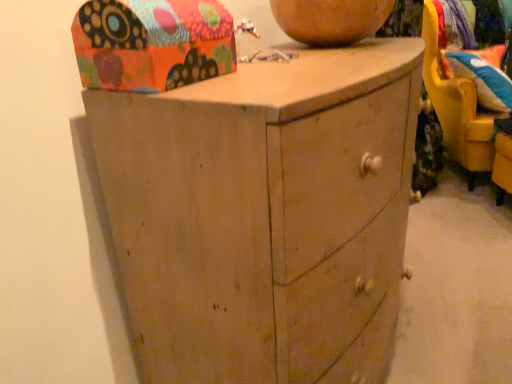
Question: Does floral fabric cushion at upper right have a larger size compared to multicolored paper shoe box at upper left?

Choices:
 (A) yes
 (B) no

Answer: (A)

Question: Are floral fabric cushion at upper right and multicolored paper shoe box at upper left far apart?

Choices:
 (A) yes
 (B) no

Answer: (A)

Question: Is floral fabric cushion at upper right wider than multicolored paper shoe box at upper left?

Choices:
 (A) no
 (B) yes

Answer: (B)

Question: From the image's perspective, is floral fabric cushion at upper right located above multicolored paper shoe box at upper left?

Choices:
 (A) yes
 (B) no

Answer: (A)

Question: Is floral fabric cushion at upper right thinner than multicolored paper shoe box at upper left?

Choices:
 (A) yes
 (B) no

Answer: (B)

Question: Is floral fabric cushion at upper right facing away from multicolored paper shoe box at upper left?

Choices:
 (A) yes
 (B) no

Answer: (B)

Question: Could you tell me if multicolored paper shoe box at upper left is turned towards velvet blue pillow at right?

Choices:
 (A) yes
 (B) no

Answer: (B)

Question: Considering the relative sizes of multicolored paper shoe box at upper left and velvet blue pillow at right in the image provided, is multicolored paper shoe box at upper left bigger than velvet blue pillow at right?

Choices:
 (A) yes
 (B) no

Answer: (B)

Question: Does multicolored paper shoe box at upper left have a lesser height compared to velvet blue pillow at right?

Choices:
 (A) no
 (B) yes

Answer: (B)

Question: Does multicolored paper shoe box at upper left have a greater height compared to velvet blue pillow at right?

Choices:
 (A) no
 (B) yes

Answer: (A)

Question: Would you say multicolored paper shoe box at upper left contains velvet blue pillow at right?

Choices:
 (A) yes
 (B) no

Answer: (B)

Question: Is multicolored paper shoe box at upper left thinner than velvet blue pillow at right?

Choices:
 (A) no
 (B) yes

Answer: (B)

Question: Would you say floral fabric cushion at upper right is a long distance from matte wood chest of drawers at center?

Choices:
 (A) no
 (B) yes

Answer: (B)